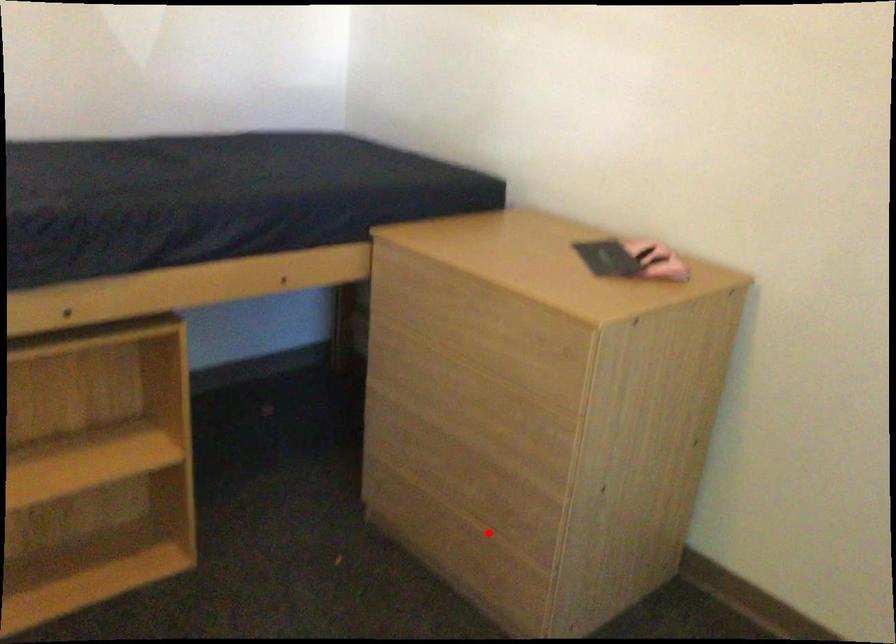
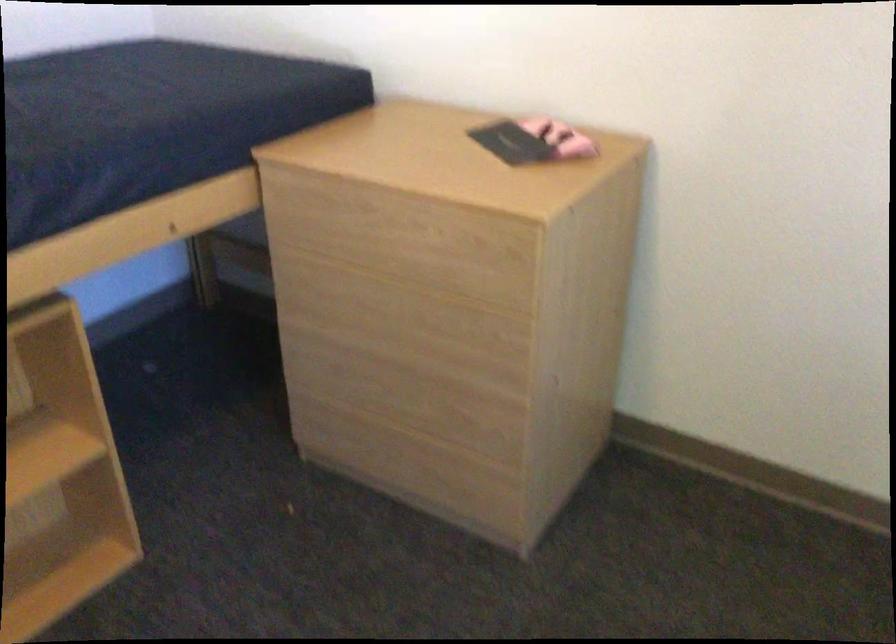
The point at the highlighted location is marked in the first image. Where is the corresponding point in the second image?

(451, 440)